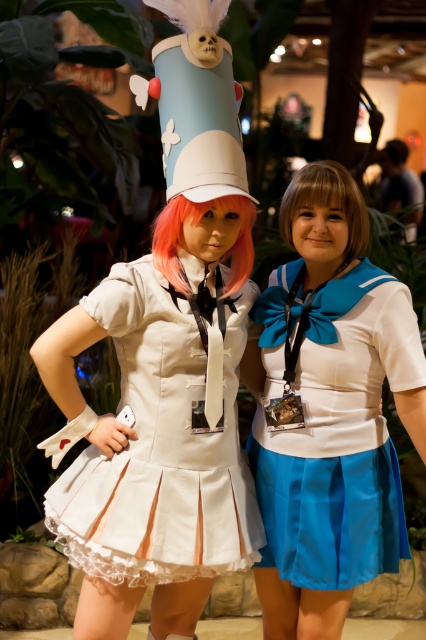
You are a photographer at the convention center. You need to position a spotlight exactly at the center of the white satin dress at center. According to the coordinates provided, what are the exact coordinates where you should place the spotlight?

The exact coordinates to place the spotlight at the center of the white satin dress at center are point (161, 445).

You are a photographer standing in front of the white satin dress at center. You want to take a photo of it without any foreground obstructions. Since the dress is 1.81 meters away from you, what is the minimum distance you need to move backward to ensure there are no objects between you and the dress?

Since the white satin dress at center is 1.81 meters away from the camera, you need to move back at least 1.81 meters to ensure there are no foreground objects between you and the dress.

You are standing in a convention center and want to take a photo of the point at coordinates (91, 573). If your camera can focus on objects within 2 meters, will it be able to capture that point clearly?

The distance of point (91, 573) from the viewer is 1.88 meters, so yes, the camera can focus on it clearly since it is within the 2 meters range.